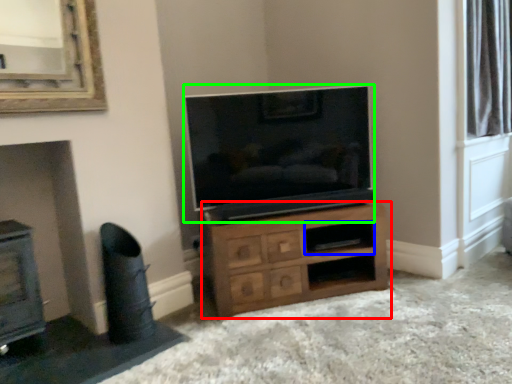
Question: Considering the real-world distances, which object is closest to chest of drawers (highlighted by a red box)? shelf (highlighted by a blue box) or television (highlighted by a green box).

Choices:
 (A) shelf
 (B) television

Answer: (A)